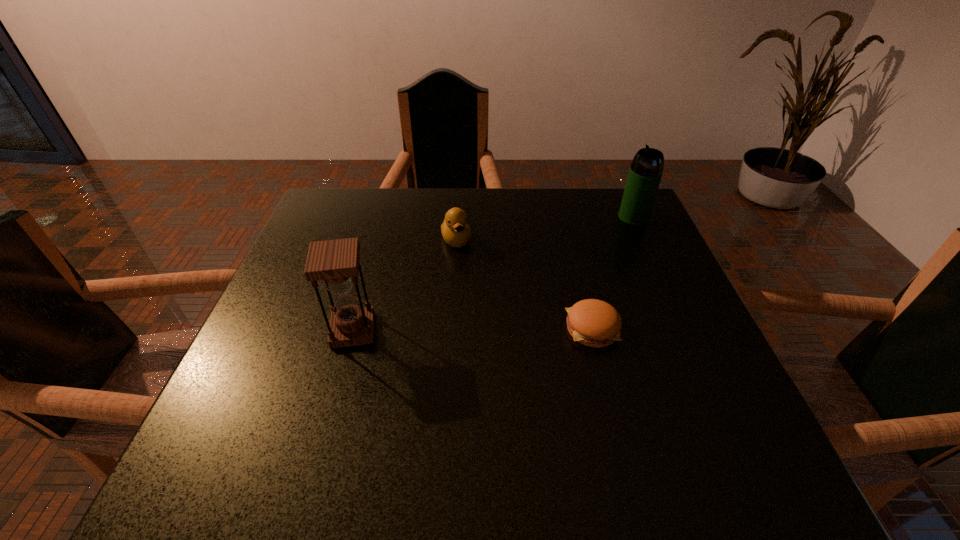
This screenshot has width=960, height=540. In order to click on vacant space on the desktop that is between the leftmost object and the patty and is positioned from the spout of the farthest object in this screenshot , I will do `click(491, 329)`.

At what (x,y) coordinates should I click in order to perform the action: click on free space on the desktop that is between the leftmost object and the patty and is positioned on the face of the second shortest object. Please return your answer as a coordinate pair (x, y). Looking at the image, I should click on (487, 329).